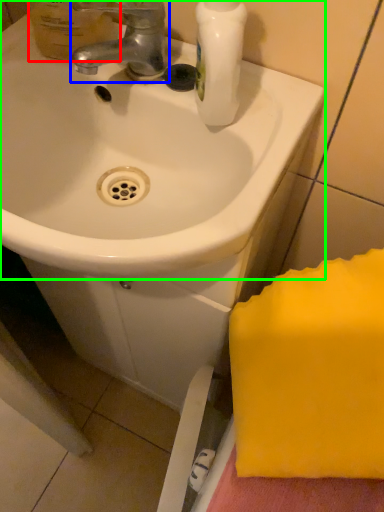
Question: Based on their relative distances, which object is farther from mouthwash (highlighted by a red box)? Choose from tap (highlighted by a blue box) and sink (highlighted by a green box).

Choices:
 (A) tap
 (B) sink

Answer: (B)